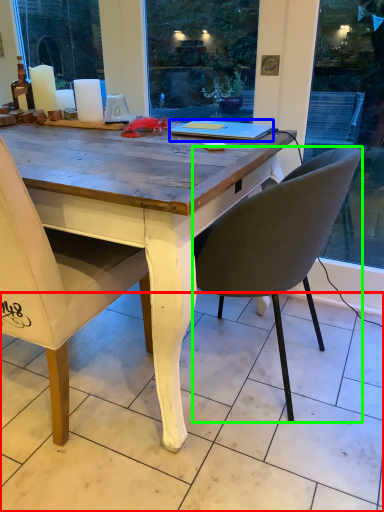
Question: Estimate the real-world distances between objects in this image. Which object is farther from tile (highlighted by a red box), laptop (highlighted by a blue box) or chair (highlighted by a green box)?

Choices:
 (A) laptop
 (B) chair

Answer: (A)